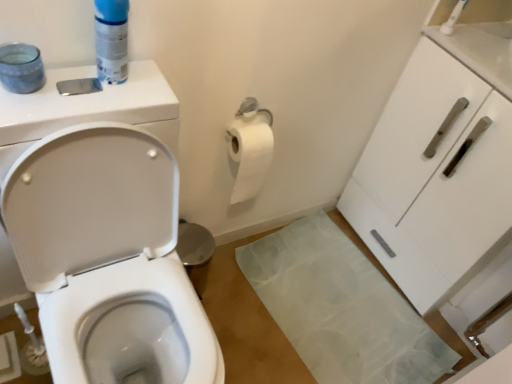
Question: Is white glossy toilet at left closer to camera compared to blue plastic can at upper left?

Choices:
 (A) yes
 (B) no

Answer: (A)

Question: From a real-world perspective, is white glossy toilet at left physically below blue plastic can at upper left?

Choices:
 (A) no
 (B) yes

Answer: (B)

Question: Can you confirm if white glossy toilet at left is bigger than blue plastic can at upper left?

Choices:
 (A) yes
 (B) no

Answer: (A)

Question: Can you confirm if white glossy toilet at left is shorter than blue plastic can at upper left?

Choices:
 (A) no
 (B) yes

Answer: (A)

Question: Is white glossy toilet at left thinner than blue plastic can at upper left?

Choices:
 (A) yes
 (B) no

Answer: (B)

Question: From a real-world perspective, is blue plastic can at upper left positioned above or below white glossy cabinet at right?

Choices:
 (A) below
 (B) above

Answer: (B)

Question: From the image's perspective, is blue plastic can at upper left positioned above or below white glossy cabinet at right?

Choices:
 (A) below
 (B) above

Answer: (B)

Question: Considering the positions of point (105, 51) and point (501, 140), is point (105, 51) closer or farther from the camera than point (501, 140)?

Choices:
 (A) farther
 (B) closer

Answer: (B)

Question: In terms of size, does blue plastic can at upper left appear bigger or smaller than white glossy cabinet at right?

Choices:
 (A) big
 (B) small

Answer: (B)

Question: Considering the positions of blue plastic can at upper left and white glossy toilet at left in the image, is blue plastic can at upper left bigger or smaller than white glossy toilet at left?

Choices:
 (A) big
 (B) small

Answer: (B)

Question: Is blue plastic can at upper left spatially inside white glossy toilet at left, or outside of it?

Choices:
 (A) inside
 (B) outside

Answer: (B)

Question: Considering their positions, is blue plastic can at upper left located in front of or behind white glossy toilet at left?

Choices:
 (A) front
 (B) behind

Answer: (B)

Question: Does point (95, 0) appear closer or farther from the camera than point (128, 244)?

Choices:
 (A) farther
 (B) closer

Answer: (B)

Question: From the image's perspective, is white glossy cabinet at right above or below white glossy toilet at left?

Choices:
 (A) below
 (B) above

Answer: (B)

Question: Is white glossy cabinet at right bigger or smaller than white glossy toilet at left?

Choices:
 (A) small
 (B) big

Answer: (A)